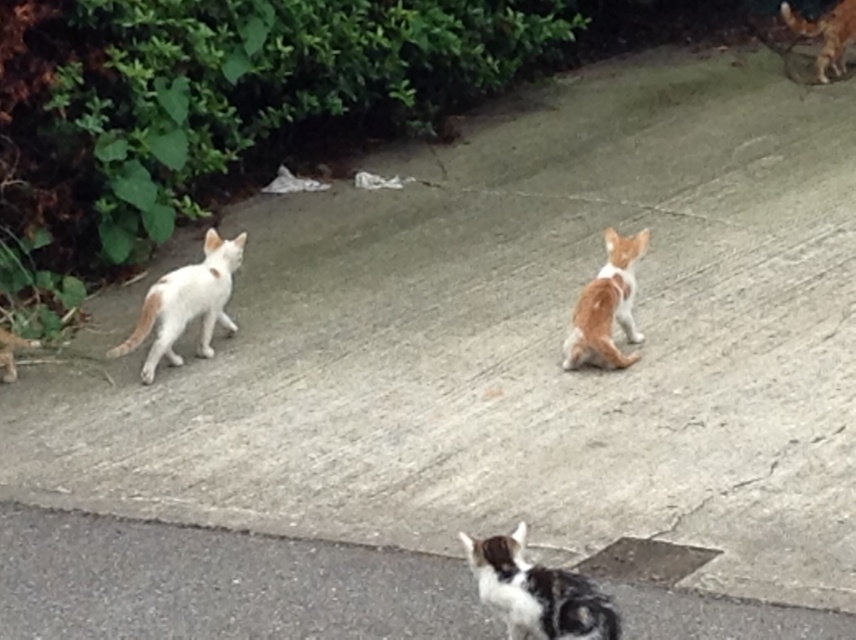
Looking at this image, does white fur cat at left have a smaller size compared to orange fur cat at center?

Actually, white fur cat at left might be larger than orange fur cat at center.

Does white fur cat at left come behind orange fur cat at center?

Yes, white fur cat at left is behind orange fur cat at center.

Between point (158, 349) and point (574, 364), which one is positioned in front?

Point (574, 364)

The image size is (856, 640). What are the coordinates of `white fur cat at left` in the screenshot? It's located at (186, 304).

Is point (415, 627) positioned before point (633, 360)?

Yes, it is.

Who is positioned more to the right, smooth asphalt at lower center or orange fur cat at center?

Positioned to the right is orange fur cat at center.

Which is behind, point (3, 602) or point (621, 282)?

Point (621, 282)

You are a GUI agent. You are given a task and a screenshot of the screen. Output one action in this format:
    pyautogui.click(x=<x>, y=<y>)
    Task: Click on the smooth asphalt at lower center
    This screenshot has width=856, height=640.
    Given the screenshot: What is the action you would take?
    pyautogui.click(x=218, y=582)

Does smooth asphalt at lower center have a greater width compared to calico fur cat at lower center?

Yes.

Does point (70, 593) come farther from viewer compared to point (473, 556)?

Yes, it is.

Identify the location of smooth asphalt at lower center. This screenshot has width=856, height=640. (218, 582).